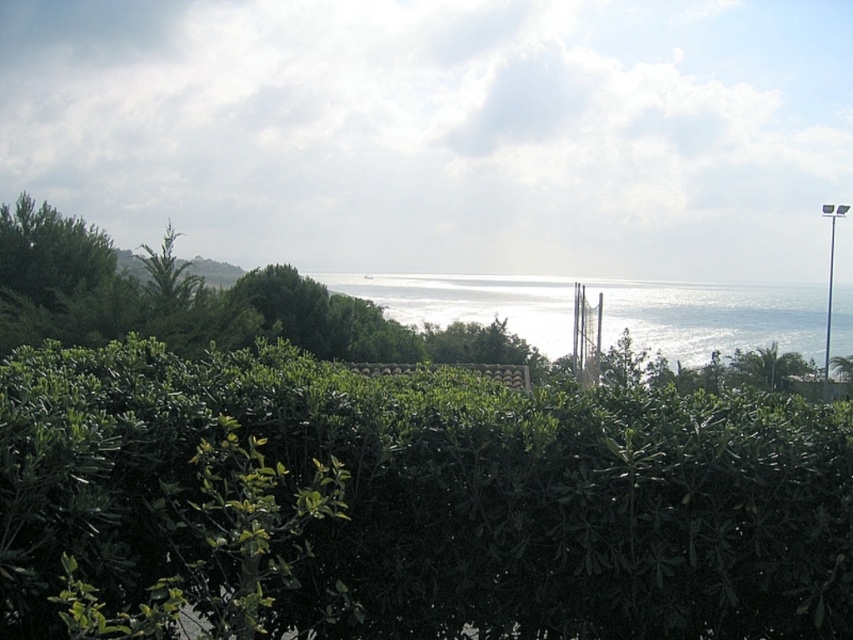
Question: Is green leafy hedge at center further to the viewer compared to glistening silver water at center?

Choices:
 (A) no
 (B) yes

Answer: (A)

Question: Is the position of green leafy hedge at center more distant than that of glistening silver water at center?

Choices:
 (A) yes
 (B) no

Answer: (B)

Question: Which point is closer to the camera?

Choices:
 (A) (370, 285)
 (B) (321, 532)

Answer: (B)

Question: Can you confirm if green leafy hedge at center is positioned to the left of glistening silver water at center?

Choices:
 (A) no
 (B) yes

Answer: (B)

Question: Which object is closer to the camera taking this photo?

Choices:
 (A) green leafy hedge at center
 (B) glistening silver water at center

Answer: (A)